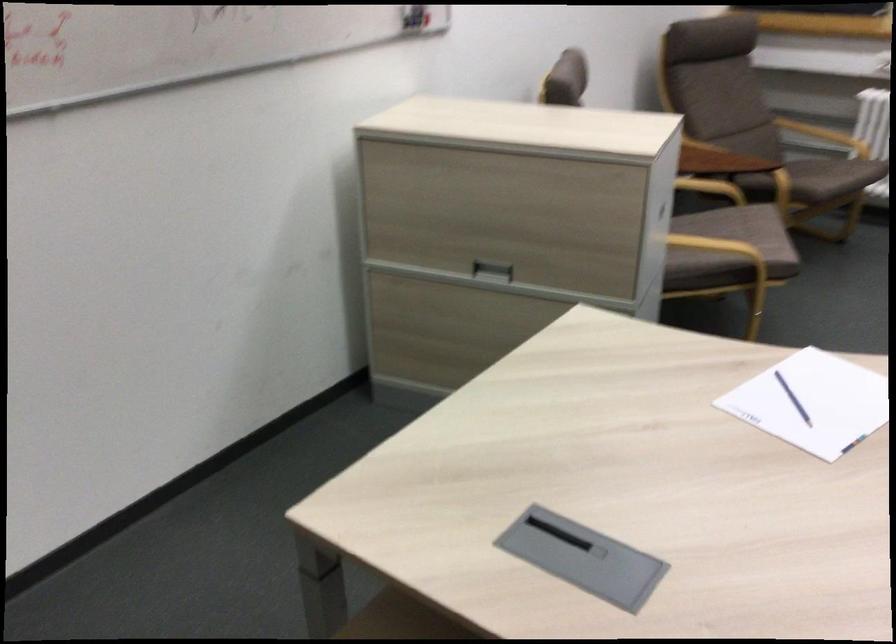
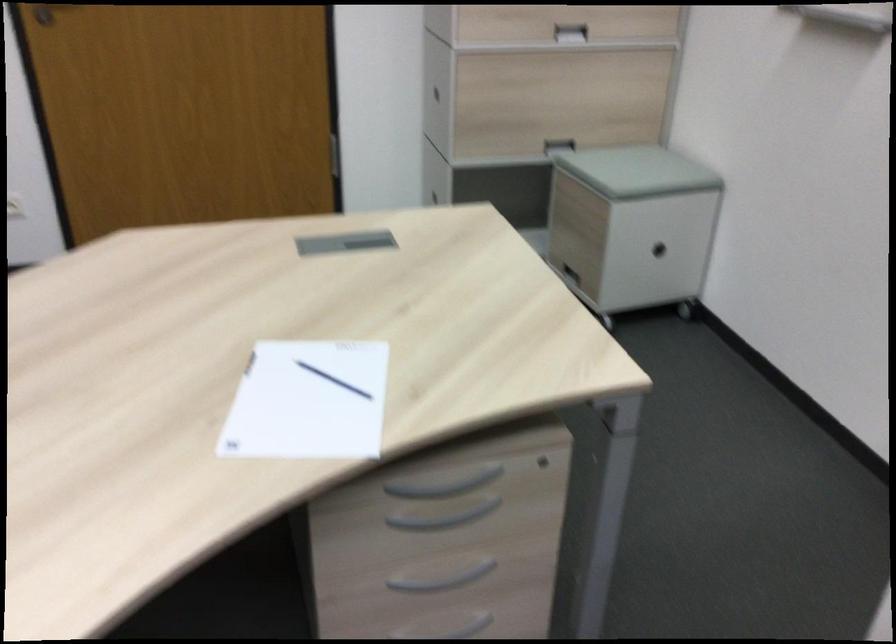
Locate, in the second image, the point that corresponds to pixel 776 413 in the first image.

(333, 380)